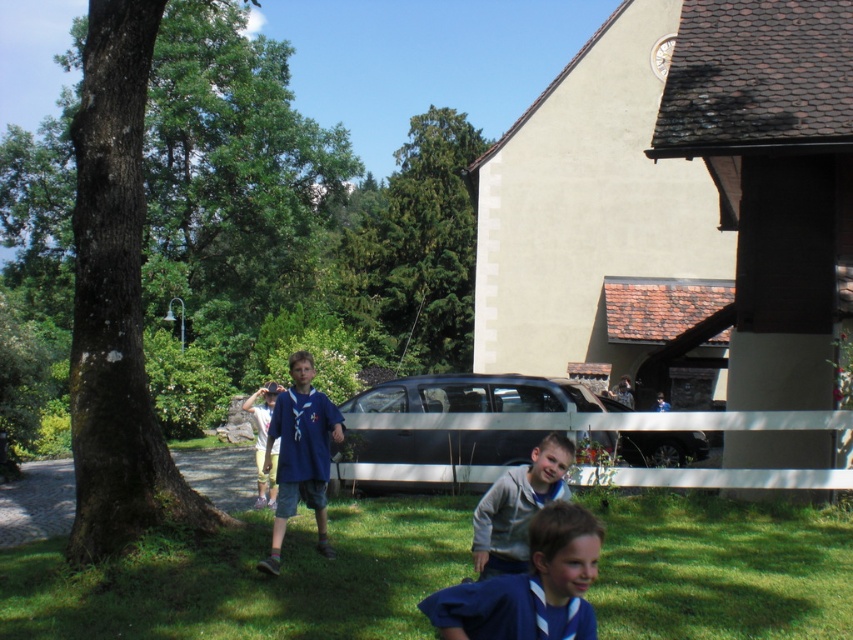
Can you confirm if green rough bark tree at left is bigger than silver metallic van at center?

Correct, green rough bark tree at left is larger in size than silver metallic van at center.

Who is more distant from viewer, (200, 275) or (566, 381)?

The point (200, 275) is behind.

The height and width of the screenshot is (640, 853). Identify the location of green rough bark tree at left. (230, 176).

Between matte blue shirt at center and blue cotton shirt at center, which one has less height?

With less height is blue cotton shirt at center.

Is point (305, 458) behind point (271, 445)?

No, (305, 458) is in front of (271, 445).

Find the location of a particular element. matte blue shirt at center is located at coordinates (300, 454).

Does blue fabric shirt at lower center have a lesser height compared to gray fleece jacket at lower center?

Yes, blue fabric shirt at lower center is shorter than gray fleece jacket at lower center.

Describe the element at coordinates (531, 586) in the screenshot. The image size is (853, 640). I see `blue fabric shirt at lower center` at that location.

Where is `blue fabric shirt at lower center`? The image size is (853, 640). blue fabric shirt at lower center is located at coordinates (531, 586).